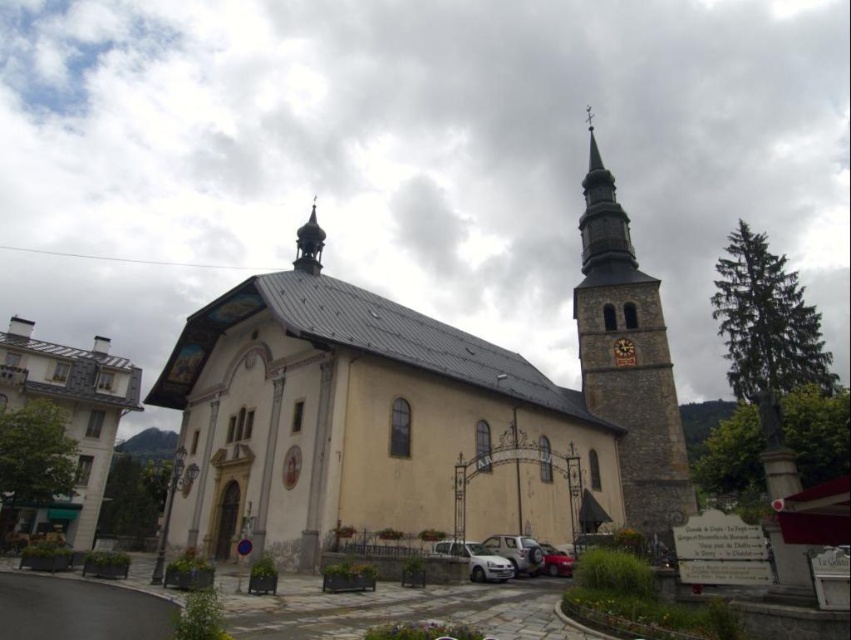
You are a delivery driver with a truck that is 10 meters long. You need to park your truck between the white matte car at lower center and the church. Is there enough space between them?

The distance between the white matte car at lower center and the church is 54.02 meters. Since the truck is only 10 meters long, there is sufficient space to park between them.

You are standing in front of the church and want to determine the relative positions of two points marked on the church facade. The first point is at coordinates point (477, 344) and the second is at point (523, 545). Which point is closer to you?

Point (477, 344) is closer to you because it is further to the viewer than point (523, 545).

You are a photographer planning to capture the yellow stone church at center and the silver metallic car at lower center in a single shot. Given that the car is closer to you, will the church still appear larger in the photo compared to the car?

The yellow stone church at center is larger in size than the silver metallic car at lower center, so even though the car is closer, the church will still appear larger in the photo because its actual size is bigger.